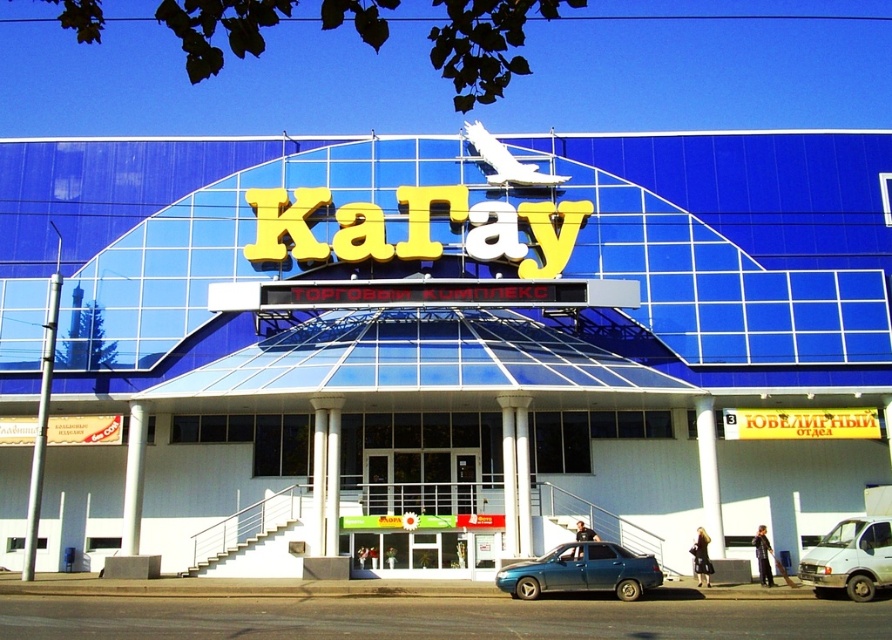
Question: Is blue glass building at center positioned before white matte van at lower right?

Choices:
 (A) yes
 (B) no

Answer: (B)

Question: Which point is farther from the camera taking this photo?

Choices:
 (A) (451, 339)
 (B) (603, 563)
 (C) (843, 564)

Answer: (A)

Question: Which is nearer to the white matte van at lower right?

Choices:
 (A) metallic blue sedan at center
 (B) blue glass building at center

Answer: (A)

Question: Observing the image, what is the correct spatial positioning of blue glass building at center in reference to white matte van at lower right?

Choices:
 (A) below
 (B) above

Answer: (B)

Question: Which of the following is the farthest from the observer?

Choices:
 (A) (651, 564)
 (B) (888, 550)

Answer: (A)

Question: Does blue glass building at center lie behind white matte van at lower right?

Choices:
 (A) no
 (B) yes

Answer: (B)